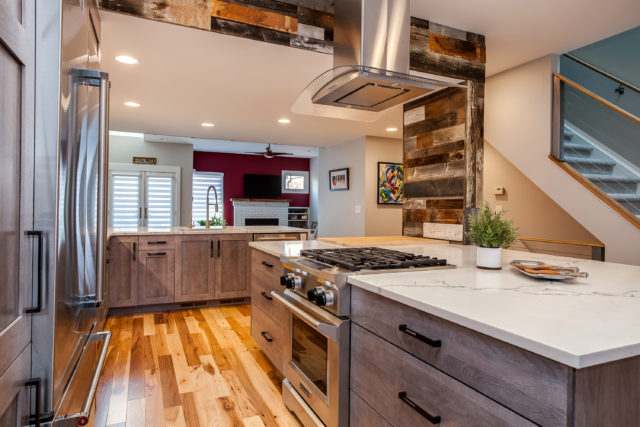
Identify the location of kitchen handles. (408, 399), (416, 332), (265, 261), (264, 294), (267, 337).